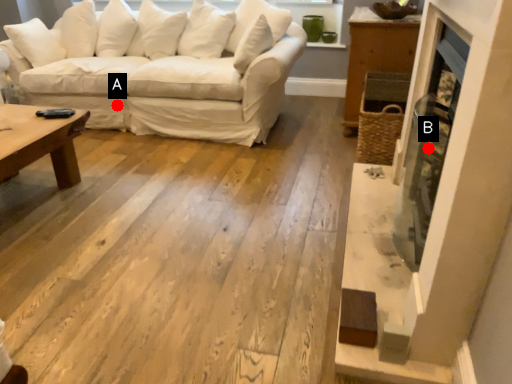
Question: Two points are circled on the image, labeled by A and B beside each circle. Among these points, which one is farthest from the camera?

Choices:
 (A) A is further
 (B) B is further

Answer: (A)